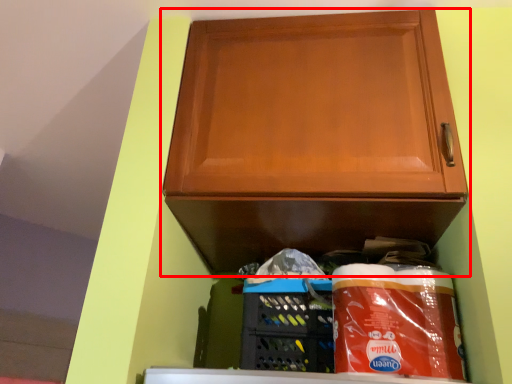
Question: From the image's perspective, considering the relative positions of cabinetry (annotated by the red box) and basket in the image provided, where is cabinetry (annotated by the red box) located with respect to the staircase?

Choices:
 (A) above
 (B) below

Answer: (A)